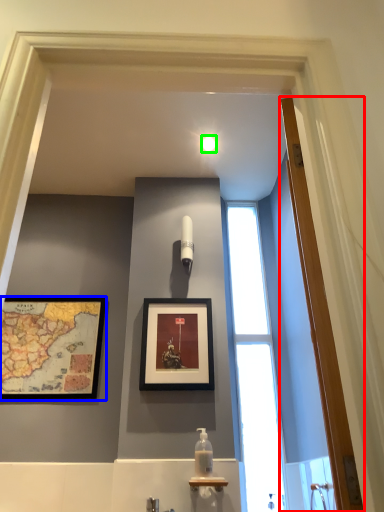
Question: Considering the real-world distances, which object is farthest from door (highlighted by a red box)? picture frame (highlighted by a blue box) or light fixture (highlighted by a green box)?

Choices:
 (A) picture frame
 (B) light fixture

Answer: (A)